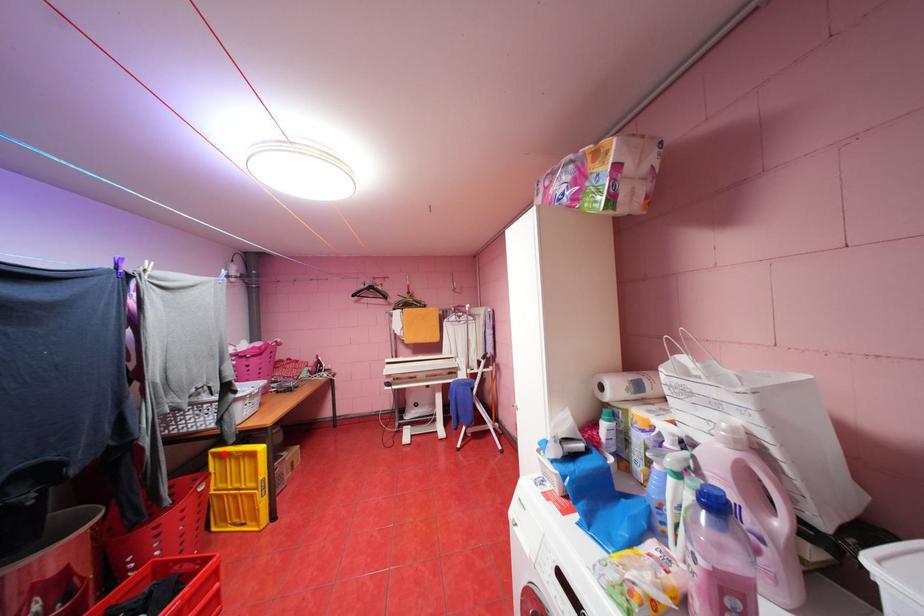
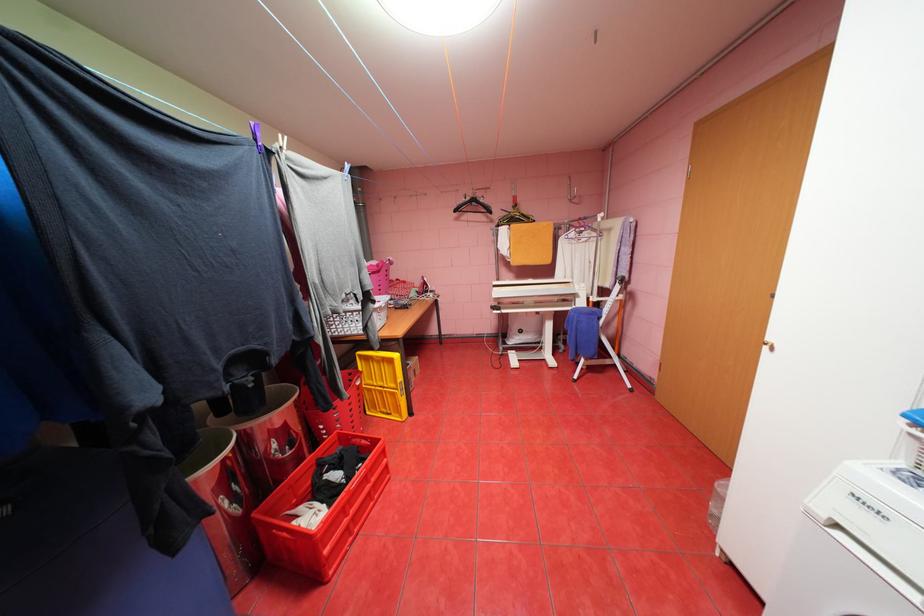
Question: I am providing you with two images of the same scene from different viewpoints. Image1 has a red point marked. In image2, the corresponding 3D location appears at what relative position? Reply with the corresponding letter.

Choices:
 (A) Closer
 (B) Farther

Answer: (A)